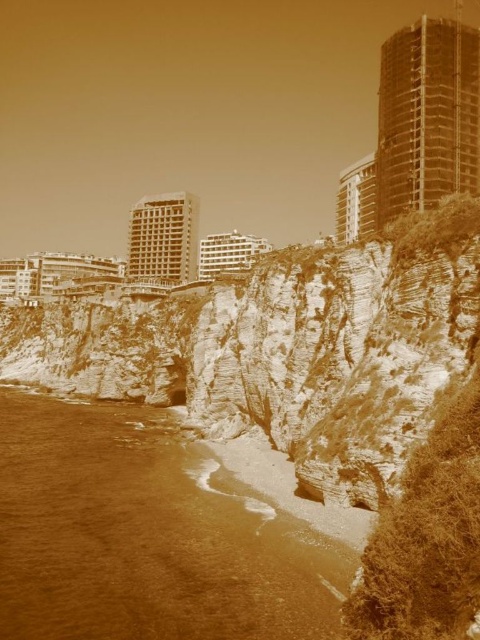
Between point (403, 92) and point (254, 241), which one is positioned behind?

Positioned behind is point (254, 241).

Which is in front, point (441, 122) or point (220, 236)?

Point (441, 122) is more forward.

Who is more forward, (395, 214) or (197, 269)?

Positioned in front is point (395, 214).

Identify the location of smooth concrete building at upper right. This screenshot has width=480, height=640. (427, 116).

Is point (215, 499) positioned after point (181, 234)?

That is False.

Between brown sand at lower left and matte concrete building at center, which one appears on the right side from the viewer's perspective?

brown sand at lower left

Identify the location of brown sand at lower left. Image resolution: width=480 pixels, height=640 pixels. (146, 536).

Where is `brown sand at lower left`? Image resolution: width=480 pixels, height=640 pixels. brown sand at lower left is located at coordinates (146, 536).

Is smooth concrete building at upper right below smooth concrete building at upper center?

No.

Between smooth concrete building at upper right and smooth concrete building at upper center, which one appears on the left side from the viewer's perspective?

Positioned to the left is smooth concrete building at upper center.

Image resolution: width=480 pixels, height=640 pixels. In order to click on smooth concrete building at upper right in this screenshot , I will do `click(427, 116)`.